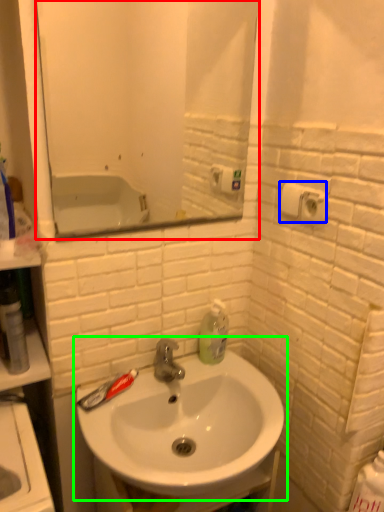
Question: Based on their relative distances, which object is farther from mirror (highlighted by a red box)? Choose from toilet paper (highlighted by a blue box) and sink (highlighted by a green box).

Choices:
 (A) toilet paper
 (B) sink

Answer: (A)